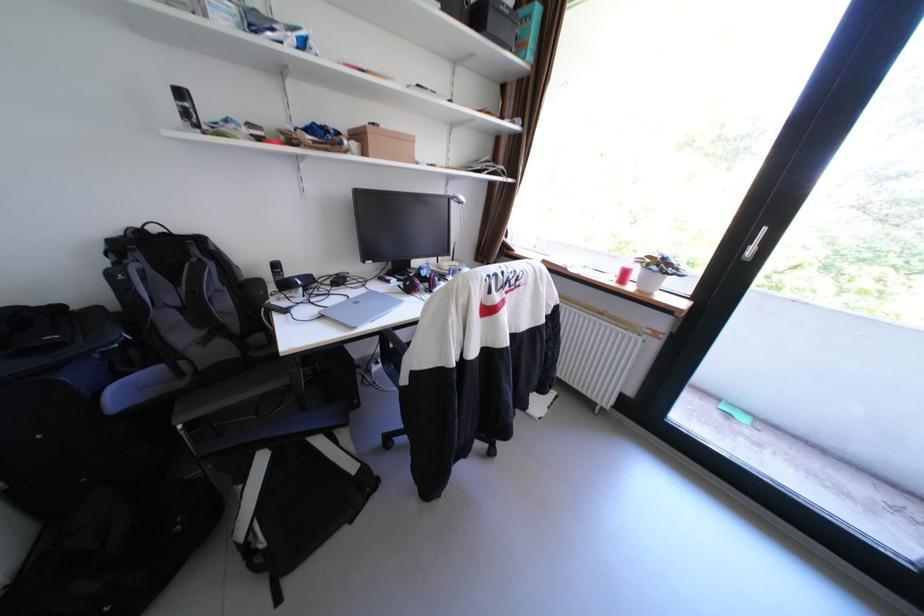
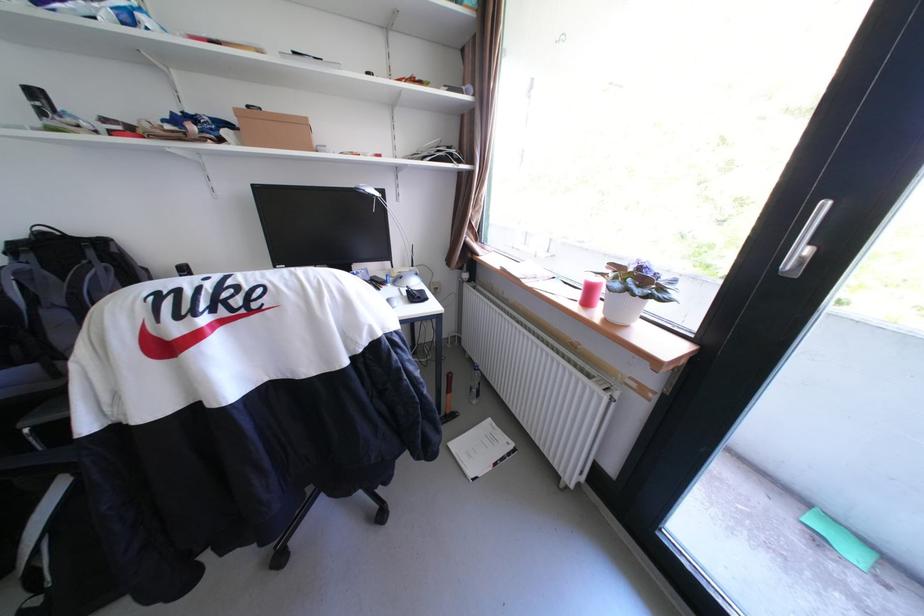
Question: The camera is either moving clockwise (left) or counter-clockwise (right) around the object. The first image is from the beginning of the video and the second image is from the end. Is the camera moving left or right when shooting the video?

Choices:
 (A) Left
 (B) Right

Answer: (B)